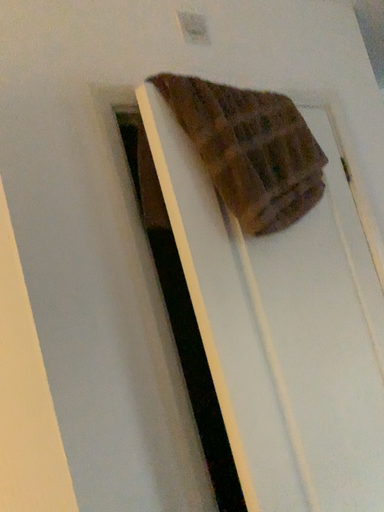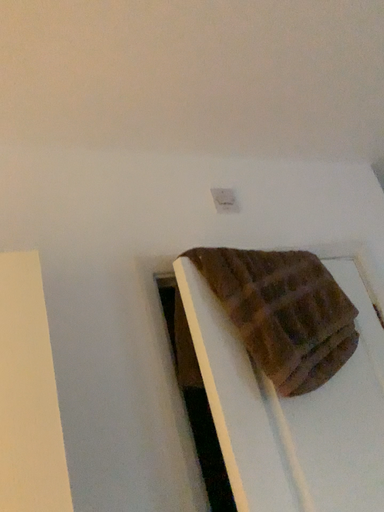
Question: How did the camera likely rotate when shooting the video?

Choices:
 (A) rotated downward
 (B) rotated upward

Answer: (B)